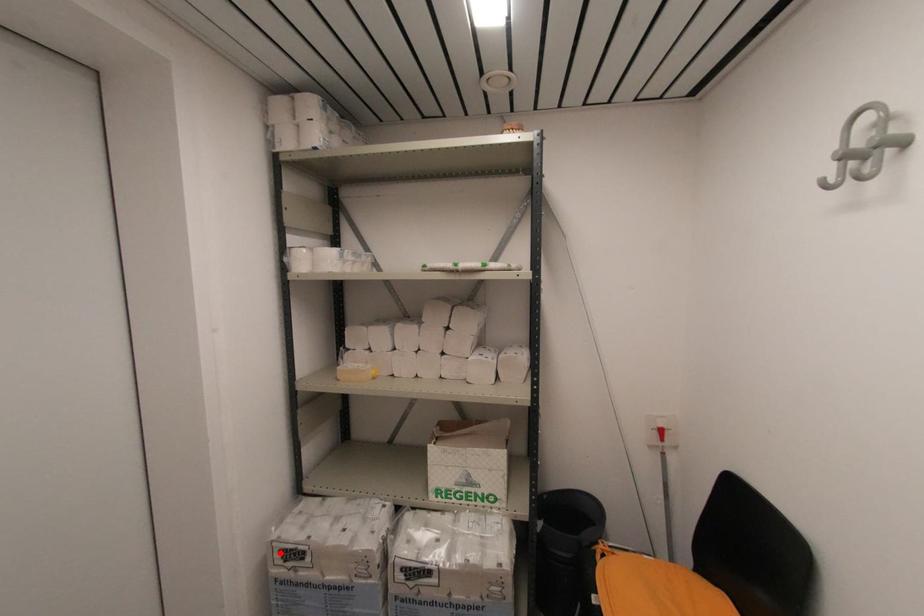
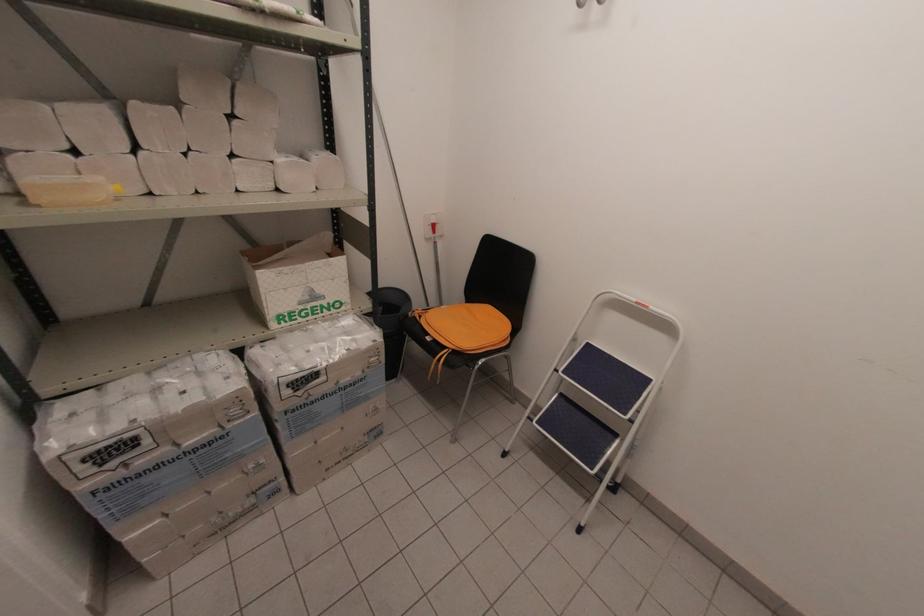
Where in the second image is the point corresponding to the highlighted location from the first image?

(84, 463)